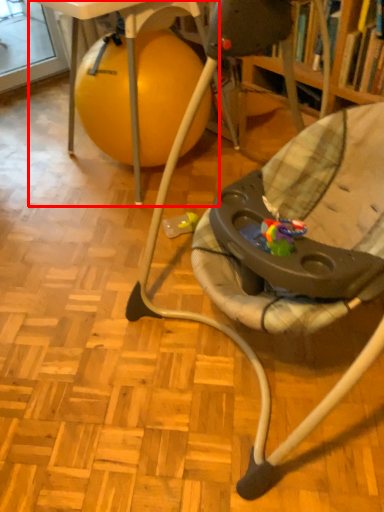
Question: Where is table (annotated by the red box) located in relation to chair in the image?

Choices:
 (A) left
 (B) right

Answer: (A)